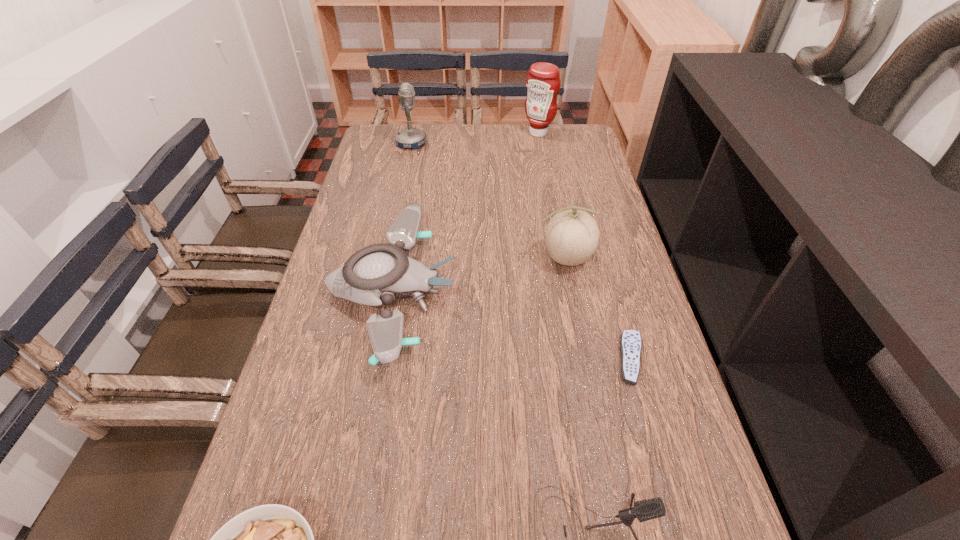
The width and height of the screenshot is (960, 540). I want to click on free space between the shortest object and the taller microphone, so click(x=521, y=251).

Identify which object is located as the sixth nearest to the taller microphone. Please provide its 2D coordinates. Your answer should be formatted as a tuple, i.e. [(x, y)], where the tuple contains the x and y coordinates of a point satisfying the conditions above.

[(272, 539)]

This screenshot has height=540, width=960. In order to click on object that stands as the sixth closest to the drone in this screenshot , I will do `click(543, 83)`.

Identify the location of vacant area in the image that satisfies the following two spatial constraints: 1. on the front-facing side of the shortest object; 2. on the left side of the drone. (380, 359).